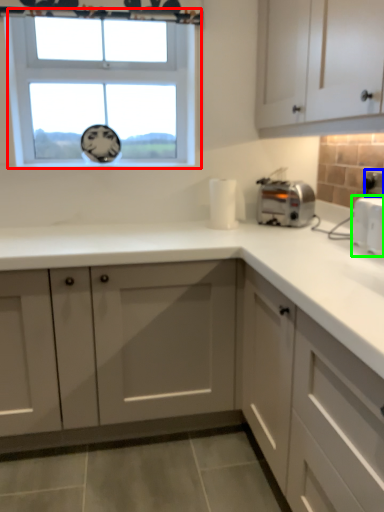
Question: Which object is positioned farthest from window (highlighted by a red box)? Select from electric outlet (highlighted by a blue box) and appliance (highlighted by a green box).

Choices:
 (A) electric outlet
 (B) appliance

Answer: (A)